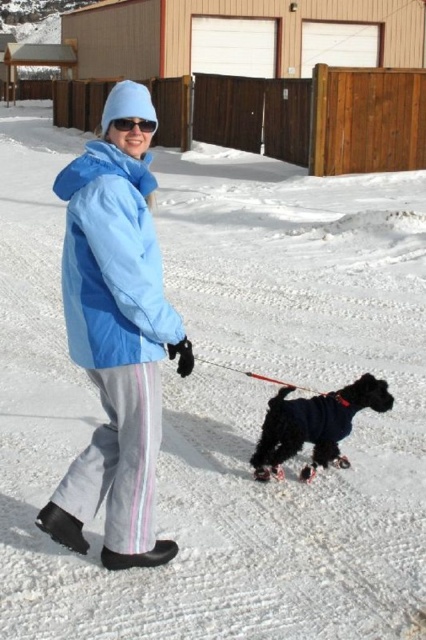
You are a photographer trying to capture the person wearing the blue matte jacket at center and the blue reflective sunglasses at upper center. Since you want to focus on the jacket, which object should you adjust your camera to prioritize in terms of depth of field?

The blue matte jacket at center is closer to the viewer than the blue reflective sunglasses at upper center. To prioritize the jacket in the depth of field, adjust the camera to focus on the blue matte jacket at center since it is nearer and will appear sharper when in focus.

You are a GPS device trying to locate the blue matte jacket at center in the winter scene. The coordinates provided are point (112, 260). Can you confirm if this coordinate matches the location of the blue matte jacket at center?

Yes, the coordinate point (112, 260) matches the location of the blue matte jacket at center as described in the scene.